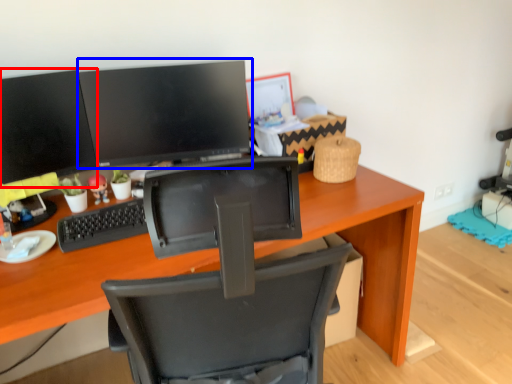
Question: Which object appears closest to the camera in this image, computer monitor (highlighted by a red box) or computer monitor (highlighted by a blue box)?

Choices:
 (A) computer monitor
 (B) computer monitor

Answer: (A)